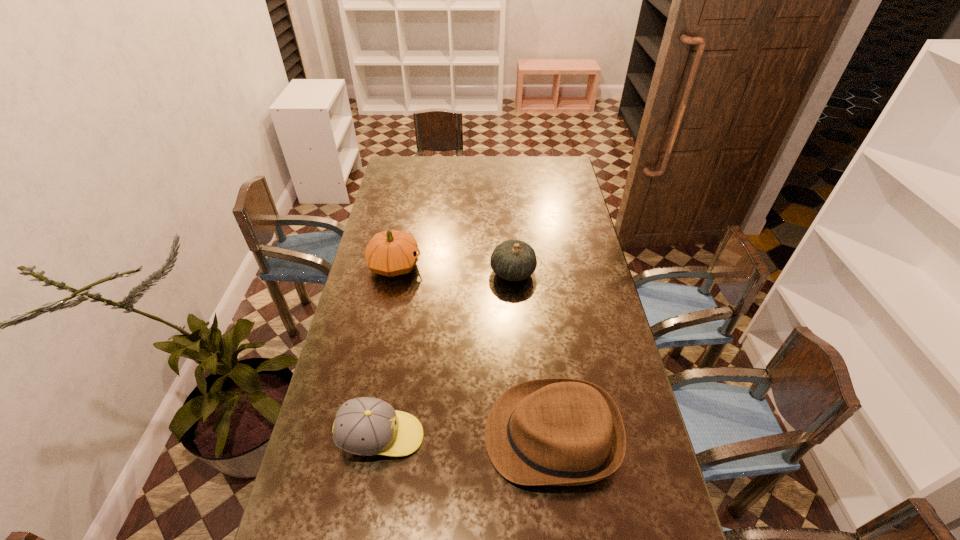
Identify the location of vacant region located 0.090m on the front-facing side of the fedora. The image size is (960, 540). (452, 436).

The width and height of the screenshot is (960, 540). In order to click on gourd present at the left edge in this screenshot , I will do `click(390, 253)`.

Identify the location of baseball cap at the left edge. This screenshot has width=960, height=540. (365, 426).

I want to click on object located in the right edge section of the desktop, so click(556, 431).

Where is `free space at the far edge of the desktop`? The height and width of the screenshot is (540, 960). free space at the far edge of the desktop is located at coordinates (435, 159).

The height and width of the screenshot is (540, 960). Find the location of `blank space at the left edge of the desktop`. blank space at the left edge of the desktop is located at coordinates (327, 383).

You are a GUI agent. You are given a task and a screenshot of the screen. Output one action in this format:
    pyautogui.click(x=<x>, y=<y>)
    Task: Click on the free space at the right edge of the desktop
    The image size is (960, 540).
    Given the screenshot: What is the action you would take?
    pyautogui.click(x=596, y=300)

Identify the location of vacant area between the left gourd and the fedora. Image resolution: width=960 pixels, height=540 pixels. (473, 350).

The width and height of the screenshot is (960, 540). Identify the location of free space that is in between the baseball cap and the left gourd. coord(388,351).

Find the location of `vacant area between the baseball cap and the taller gourd`. vacant area between the baseball cap and the taller gourd is located at coordinates (388, 351).